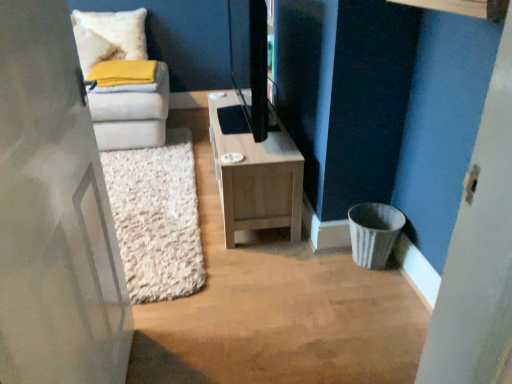
In order to click on free space in front of light wood/texture tv stand at center in this screenshot , I will do `click(264, 286)`.